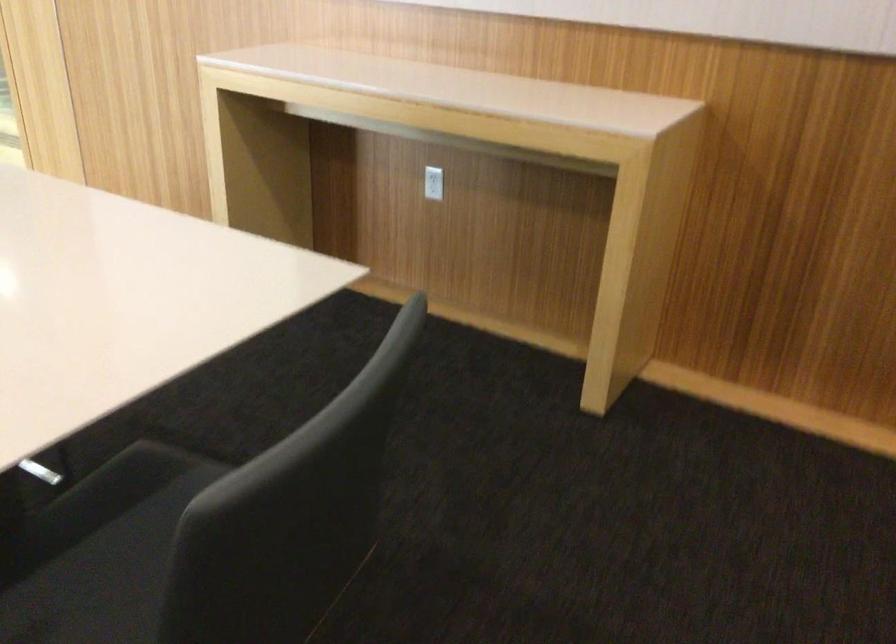
I want to click on dark chair sitting surface, so click(101, 551).